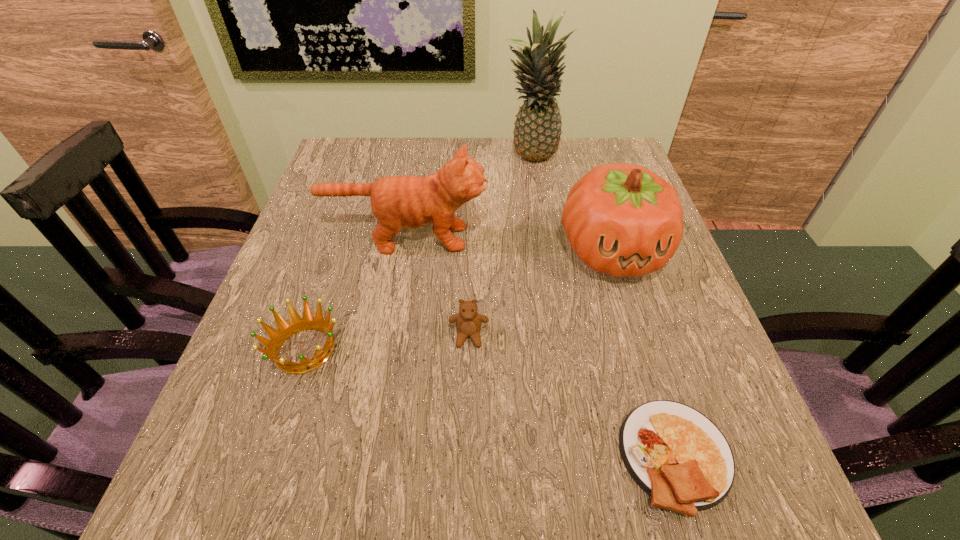
At what (x,y) coordinates should I click in order to perform the action: click on pineapple. Please return your answer as a coordinate pair (x, y). This screenshot has width=960, height=540. Looking at the image, I should click on (537, 131).

You are a GUI agent. You are given a task and a screenshot of the screen. Output one action in this format:
    pyautogui.click(x=<x>, y=<y>)
    Task: Click on the tallest object
    
    Given the screenshot: What is the action you would take?
    coord(537,131)

Where is `cat`? This screenshot has width=960, height=540. cat is located at coordinates (410, 202).

Where is `pumpkin`? The height and width of the screenshot is (540, 960). pumpkin is located at coordinates (621, 219).

Identify the location of teddy bear. (468, 322).

Where is `crown`? crown is located at coordinates (296, 324).

Image resolution: width=960 pixels, height=540 pixels. I want to click on the nearest object, so click(x=679, y=457).

Where is `the shortest object`? the shortest object is located at coordinates (679, 457).

The image size is (960, 540). In order to click on free space located 0.200m on the right of the tallest object in this screenshot , I will do `click(632, 158)`.

I want to click on blank space located 0.090m on the face of the cat, so click(527, 238).